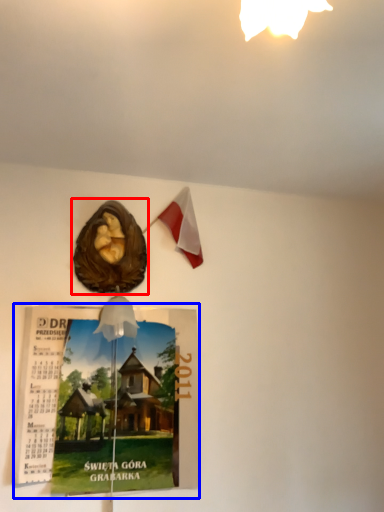
Question: Which object appears farthest to the camera in this image, flyer (highlighted by a red box) or magazine (highlighted by a blue box)?

Choices:
 (A) flyer
 (B) magazine

Answer: (A)